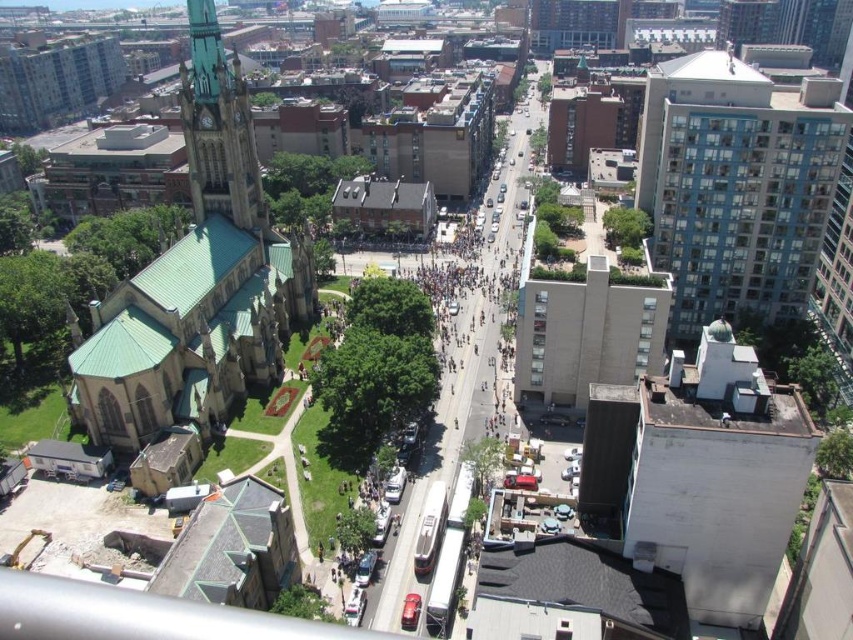
You are a drone operator flying over the urban area shown in the image. Your task is to capture a clear photo of the blue glass building at upper right and the green copper tower at upper left. From your current position, which of these two structures is closer to your camera lens?

The blue glass building at upper right is closer to the camera lens because it is positioned in front of the green copper tower at upper left in the image.

You are a city planner reviewing this area. You need to install a new communication tower that must be shorter than the tallest building in the area. Which of the two buildings, the blue glass building at upper right or the green copper tower at upper left, should you choose as the maximum height reference?

The blue glass building at upper right is taller than the green copper tower at upper left. Therefore, you should use the height of the green copper tower at upper left as the maximum height reference to ensure the new communication tower is shorter than the tallest building in the area.

You are planning to place a new streetlight between the green stone church at left and the green copper tower at upper left. Given that the church is wider than the tower, which object should the streetlight be closer to in order to maintain symmetry?

The streetlight should be closer to the green copper tower at upper left because the green stone church at left is wider than the green copper tower at upper left, so positioning it nearer to the narrower tower would help balance the structure.